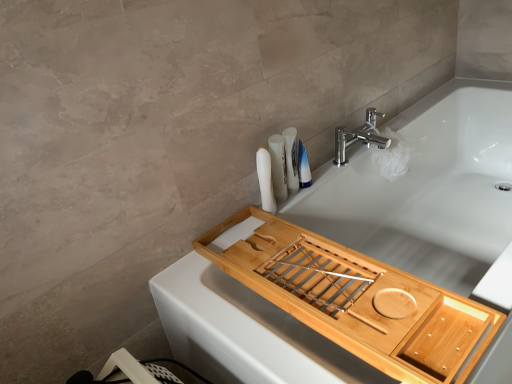
At what (x,y) coordinates should I click in order to perform the action: click on free space to the right of blue glossy bottle at upper right, which appears as the first toiletry when viewed from the right. Please return your answer as a coordinate pair (x, y). The width and height of the screenshot is (512, 384). Looking at the image, I should click on (335, 169).